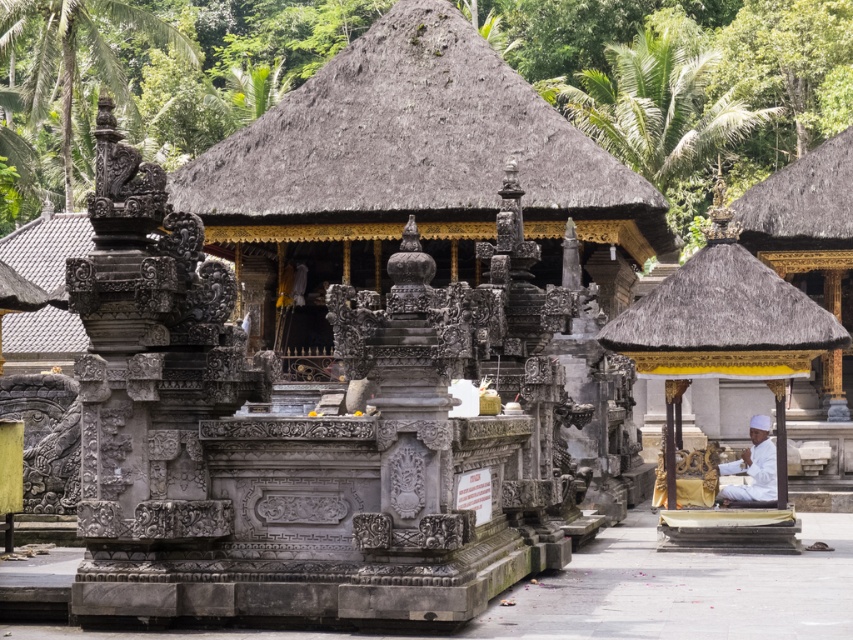
Question: Which object is closer to the camera taking this photo?

Choices:
 (A) thatched roof gazebo at right
 (B) brown thatch roof at upper right
 (C) thatched roof at center

Answer: (A)

Question: From the image, what is the correct spatial relationship of thatched roof gazebo at right in relation to brown thatch roof at upper right?

Choices:
 (A) above
 (B) below

Answer: (B)

Question: Can you confirm if thatched roof at center is positioned below brown thatch roof at upper right?

Choices:
 (A) yes
 (B) no

Answer: (B)

Question: Is thatched roof gazebo at right smaller than brown thatch roof at upper right?

Choices:
 (A) no
 (B) yes

Answer: (A)

Question: Considering the real-world distances, which object is farthest from the thatched roof at center?

Choices:
 (A) brown thatch roof at upper right
 (B) thatched roof gazebo at right

Answer: (B)

Question: Among these objects, which one is farthest from the camera?

Choices:
 (A) thatched roof gazebo at right
 (B) thatched roof at center

Answer: (B)